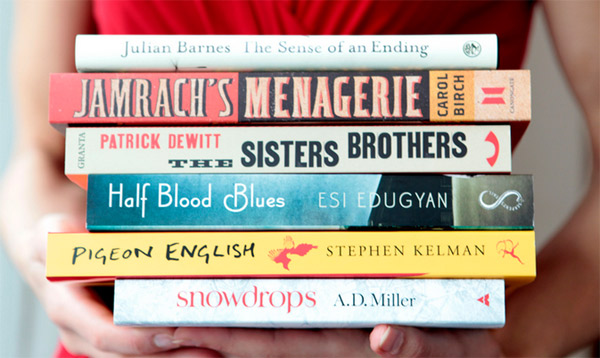
Locate an element on the screen. The image size is (600, 358). horizontally held book is located at coordinates (300, 298), (311, 258), (312, 214), (319, 153), (322, 115), (332, 45).